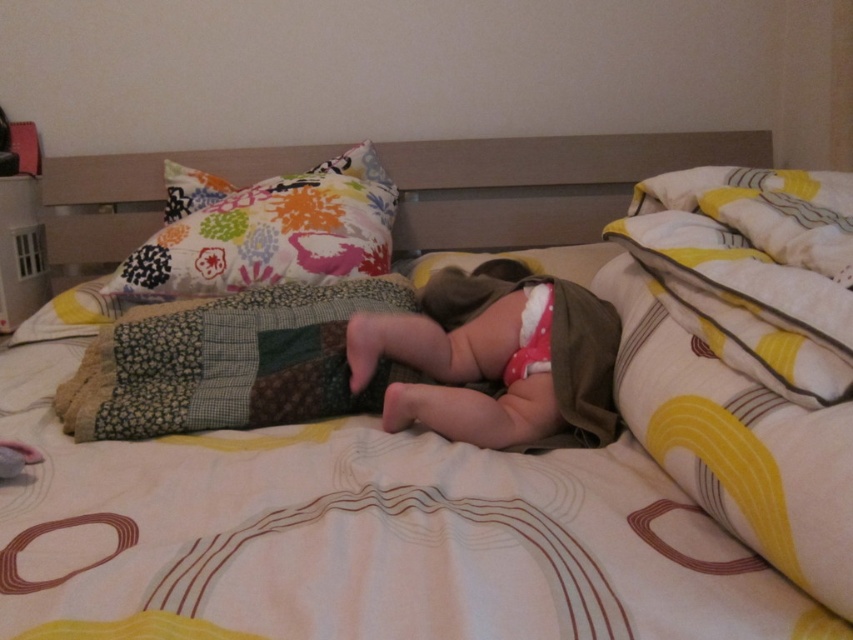
Question: Which object is positioned farthest from the multicolored fabric pillow at upper left?

Choices:
 (A) pink fabric diaper at center
 (B) white soft diaper at center

Answer: (B)

Question: Which object is closer to the camera taking this photo?

Choices:
 (A) pink fabric diaper at center
 (B) white soft diaper at center

Answer: (A)

Question: Which object appears farthest from the camera in this image?

Choices:
 (A) multicolored fabric pillow at upper left
 (B) pink fabric diaper at center

Answer: (A)

Question: Does pink fabric diaper at center have a larger size compared to multicolored fabric pillow at upper left?

Choices:
 (A) yes
 (B) no

Answer: (B)

Question: Does multicolored fabric pillow at upper left lie in front of white soft diaper at center?

Choices:
 (A) no
 (B) yes

Answer: (A)

Question: Is multicolored fabric pillow at upper left positioned at the back of white soft diaper at center?

Choices:
 (A) no
 (B) yes

Answer: (B)